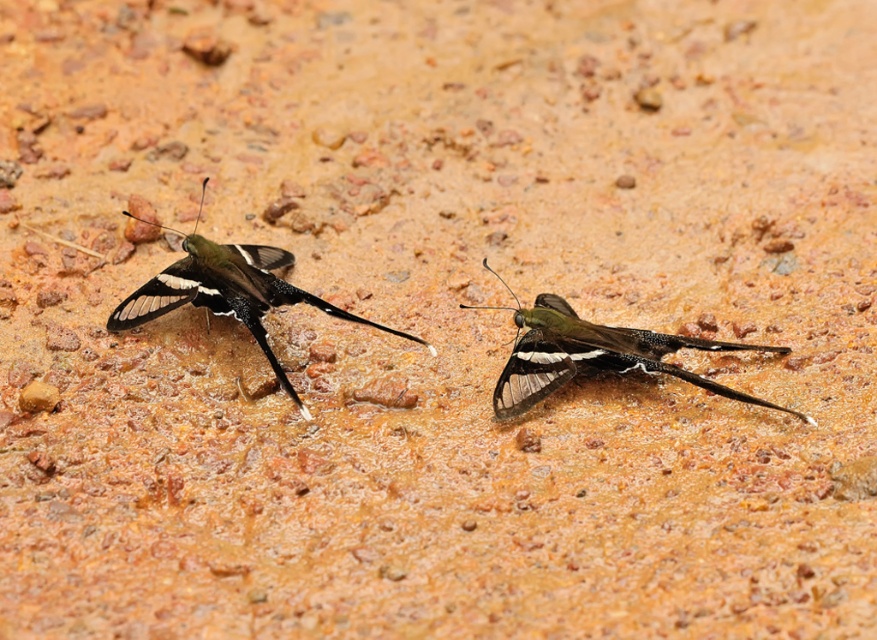
Is shiny green butterfly at center to the left of matte black butterfly at left from the viewer's perspective?

In fact, shiny green butterfly at center is to the right of matte black butterfly at left.

Does shiny green butterfly at center have a lesser width compared to matte black butterfly at left?

Yes.

Identify the location of shiny green butterfly at center. (593, 355).

Where is `shiny green butterfly at center`? This screenshot has width=877, height=640. shiny green butterfly at center is located at coordinates (593, 355).